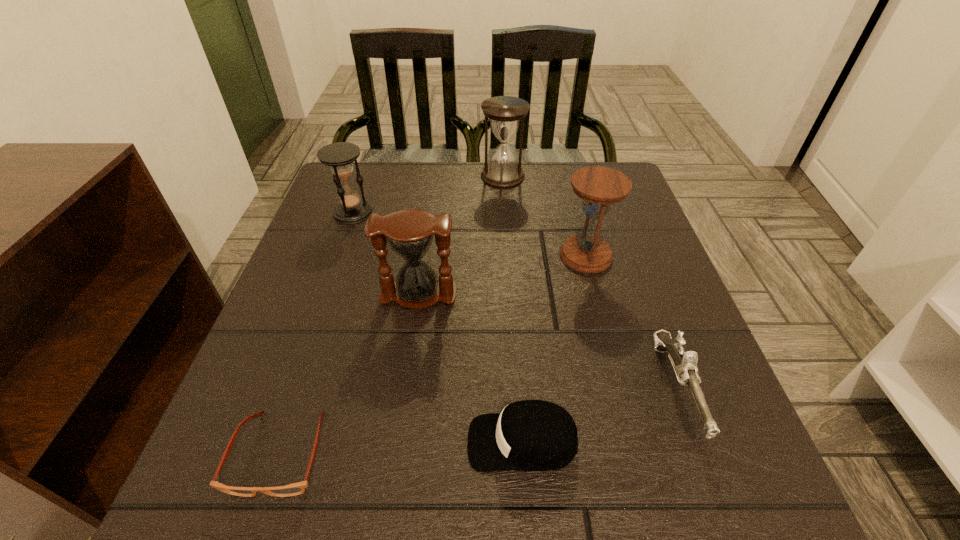
Identify the location of free space between the farthest object and the spectacles. This screenshot has width=960, height=540. (392, 315).

Find the location of `free spot between the second shortest object and the third object from left to right`. free spot between the second shortest object and the third object from left to right is located at coordinates [x=470, y=368].

Find the location of a particular element. Image resolution: width=960 pixels, height=540 pixels. unoccupied area between the rightmost hourglass and the sixth tallest object is located at coordinates (554, 349).

You are a GUI agent. You are given a task and a screenshot of the screen. Output one action in this format:
    pyautogui.click(x=<x>, y=<y>)
    Task: Click on the free spot between the rightmost hourglass and the farthest hourglass
    Image resolution: width=960 pixels, height=540 pixels.
    Given the screenshot: What is the action you would take?
    pyautogui.click(x=544, y=216)

Where is `vacant space in between the third hourglass from right to left and the farthest hourglass`? This screenshot has width=960, height=540. vacant space in between the third hourglass from right to left and the farthest hourglass is located at coordinates (461, 235).

Find the location of `object that can be found as the second closest to the rightmost object`. object that can be found as the second closest to the rightmost object is located at coordinates (599, 187).

You are a GUI agent. You are given a task and a screenshot of the screen. Output one action in this format:
    pyautogui.click(x=<x>, y=<y>)
    Task: Click on the fourth closest object to the fourth farthest object
    Image resolution: width=960 pixels, height=540 pixels.
    Given the screenshot: What is the action you would take?
    pyautogui.click(x=599, y=187)

Identify which hourglass is located as the second nearest to the second shortest object. Please provide its 2D coordinates. Your answer should be formatted as a tuple, i.e. [(x, y)], where the tuple contains the x and y coordinates of a point satisfying the conditions above.

[(599, 187)]

This screenshot has height=540, width=960. Find the location of `hourglass that is the second closest to the shortest object`. hourglass that is the second closest to the shortest object is located at coordinates (339, 156).

What are the coordinates of `blank area in the image that satisfies the following two spatial constraints: 1. on the back side of the nearest hourglass; 2. on the right side of the third farthest object` in the screenshot? It's located at (423, 255).